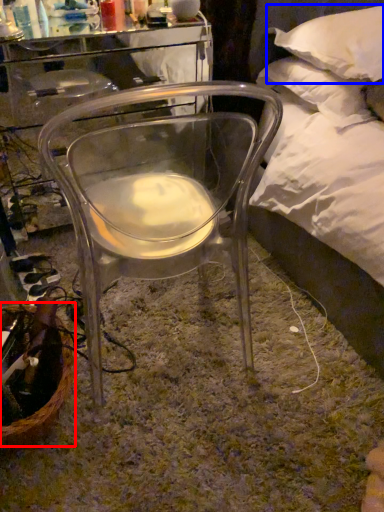
Question: Which of the following is the farthest to the observer, basket (highlighted by a red box) or pillow (highlighted by a blue box)?

Choices:
 (A) basket
 (B) pillow

Answer: (B)